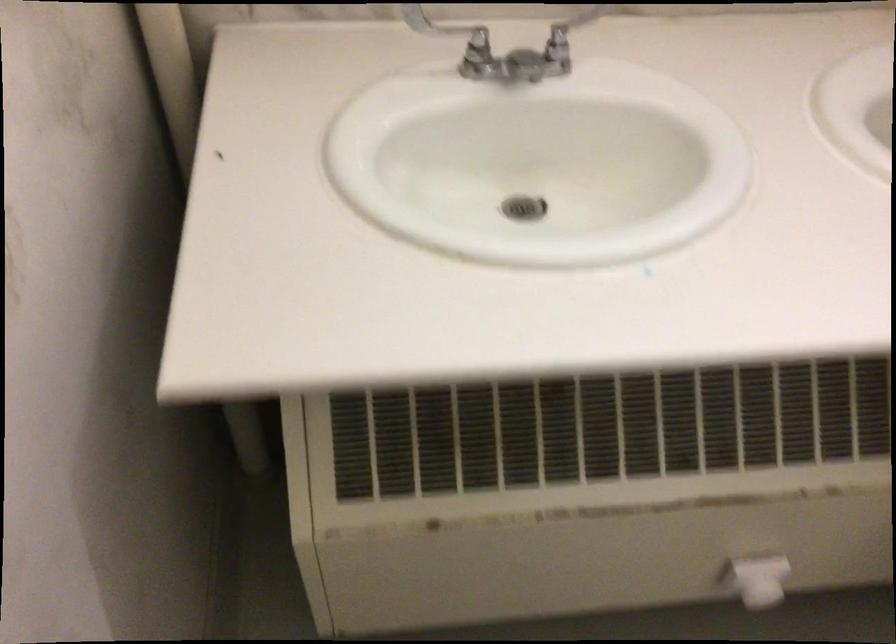
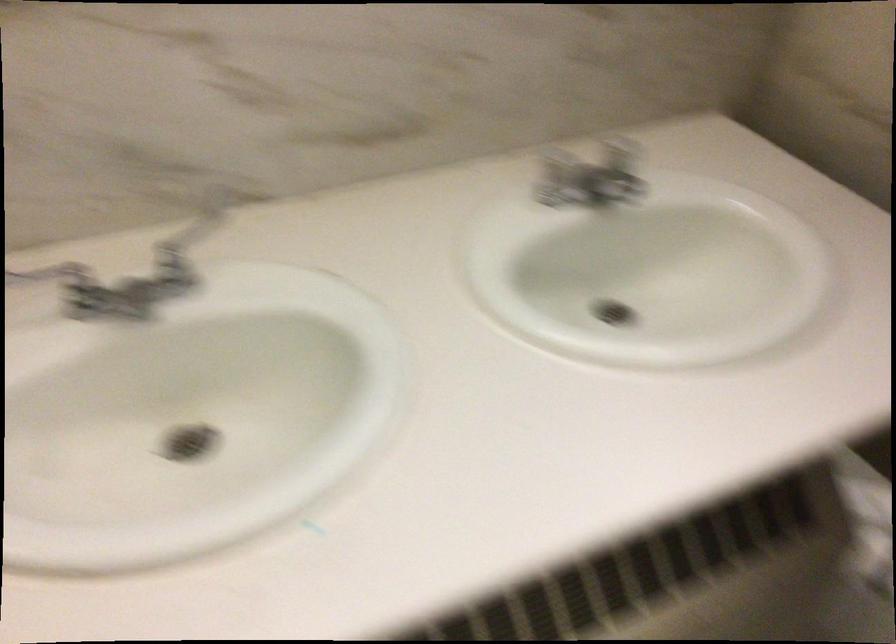
Which direction would the cameraman need to move to produce the second image?

The movement direction of the cameraman is right, forward.